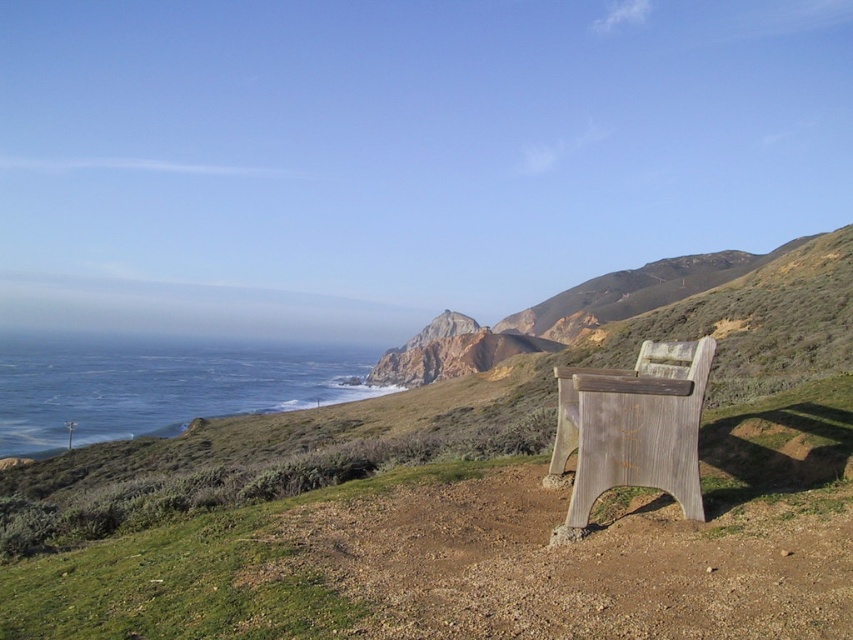
You are standing at the center of the scene and want to walk to the blue water at lower left. Which direction should you walk relative to the weathered wood park bench at right?

The blue water at lower left is to the left of the weathered wood park bench at right, so you should walk towards the left side relative to the bench to reach the water.

From the picture: You are standing on the wooden bench in the foreground of the coastal landscape. You notice two areas at the lower left corner of your view. One is labeled as green grassy at lower left and the other as blue water at lower left. Which of these two areas is closer to you?

The green grassy at lower left is positioned over blue water at lower left, so the green grassy at lower left is closer to you.

You are standing at the edge of the cliff overlooking the ocean. You see the green grassy at lower left and the weathered wood park bench at right. Which object is closer to you?

The green grassy at lower left is closer to the viewer than the weathered wood park bench at right.